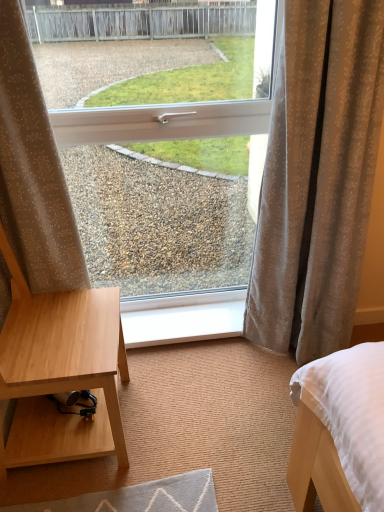
Question: Based on their positions, is beige dotted fabric at left, which is counted as the 2th curtain, starting from the right, located to the left or right of white plastic window at center?

Choices:
 (A) right
 (B) left

Answer: (B)

Question: In terms of height, does beige dotted fabric at left, which is counted as the 2th curtain, starting from the right, look taller or shorter compared to white plastic window at center?

Choices:
 (A) tall
 (B) short

Answer: (B)

Question: Considering the real-world distances, which object is closest to the beige dotted fabric at left, which is counted as the 2th curtain, starting from the right?

Choices:
 (A) white plastic window sill at center
 (B) beige textured curtain at right, which appears as the 2th curtain when viewed from the left
 (C) white plastic window at center

Answer: (A)

Question: Considering the real-world distances, which object is closest to the beige textured curtain at right, acting as the first curtain starting from the right?

Choices:
 (A) beige dotted fabric at left, which is counted as the 2th curtain, starting from the right
 (B) white plastic window sill at center
 (C) white plastic window at center

Answer: (C)